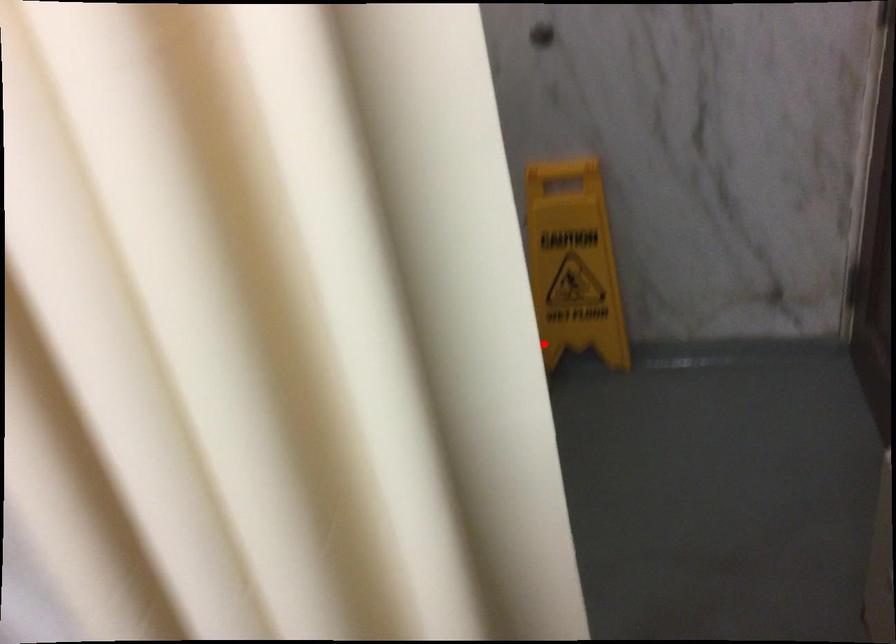
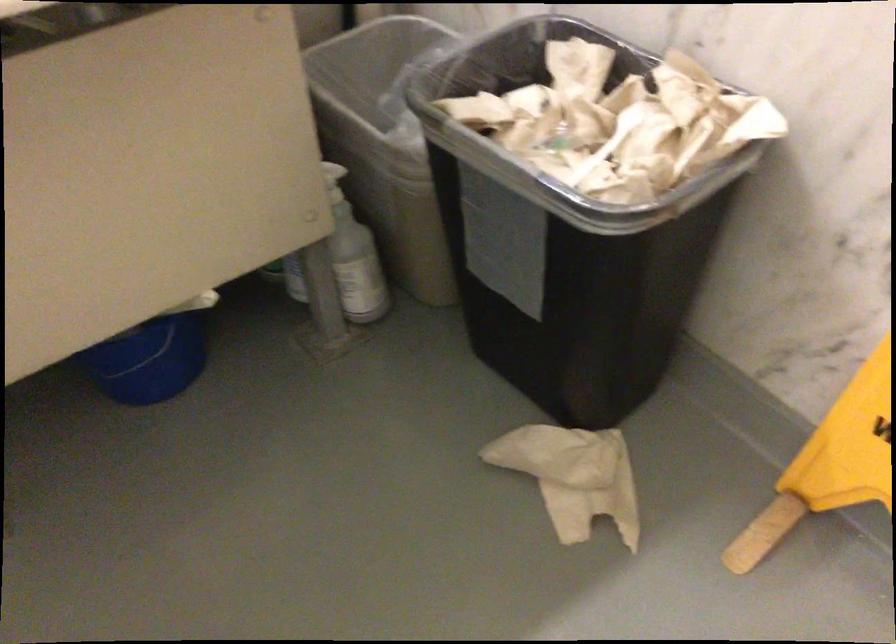
Question: I am providing you with two images of the same scene from different viewpoints. A red point is shown in image1. For the corresponding object point in image2, is it positioned nearer or farther from the camera?

Choices:
 (A) Nearer
 (B) Farther

Answer: (A)